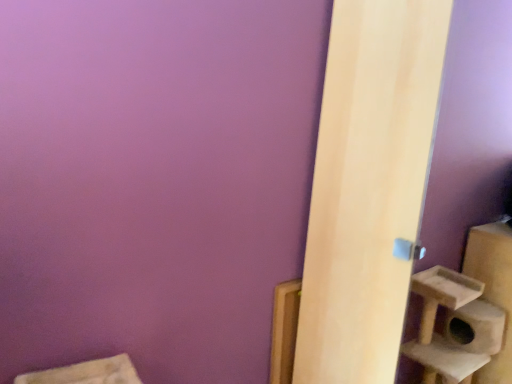
Question: Is wooden frame at lower right at the left side of light wood door at right?

Choices:
 (A) yes
 (B) no

Answer: (A)

Question: Considering the relative sizes of wooden frame at lower right and light wood door at right in the image provided, is wooden frame at lower right bigger than light wood door at right?

Choices:
 (A) yes
 (B) no

Answer: (B)

Question: Is wooden frame at lower right wider than light wood door at right?

Choices:
 (A) no
 (B) yes

Answer: (A)

Question: Is light wood door at right surrounded by wooden frame at lower right?

Choices:
 (A) no
 (B) yes

Answer: (A)

Question: Considering the relative positions of wooden frame at lower right and light wood door at right in the image provided, is wooden frame at lower right to the right of light wood door at right from the viewer's perspective?

Choices:
 (A) yes
 (B) no

Answer: (B)

Question: Is wooden frame at lower right positioned far away from light wood door at right?

Choices:
 (A) no
 (B) yes

Answer: (A)

Question: From a real-world perspective, is light wood door at right on wooden frame at lower right?

Choices:
 (A) no
 (B) yes

Answer: (B)

Question: Is light wood door at right bigger than wooden frame at lower right?

Choices:
 (A) no
 (B) yes

Answer: (B)

Question: Is light wood door at right taller than wooden frame at lower right?

Choices:
 (A) yes
 (B) no

Answer: (A)

Question: Is light wood door at right positioned with its back to wooden frame at lower right?

Choices:
 (A) no
 (B) yes

Answer: (A)

Question: Is wooden frame at lower right located within light wood door at right?

Choices:
 (A) no
 (B) yes

Answer: (A)

Question: Does light wood door at right come behind wooden frame at lower right?

Choices:
 (A) yes
 (B) no

Answer: (B)

Question: From a real-world perspective, is light wood door at right above or below wooden frame at lower right?

Choices:
 (A) below
 (B) above

Answer: (B)